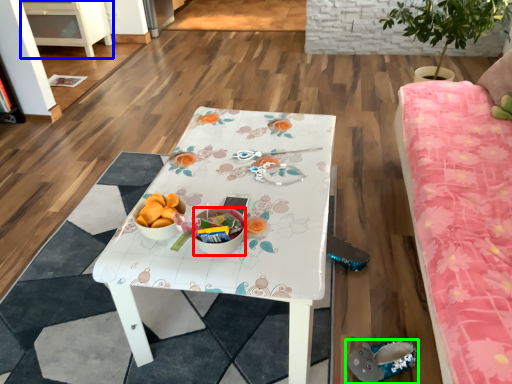
Question: Which is farther away from glass bowl (highlighted by a red box)? cabinetry (highlighted by a blue box) or footwear (highlighted by a green box)?

Choices:
 (A) cabinetry
 (B) footwear

Answer: (A)